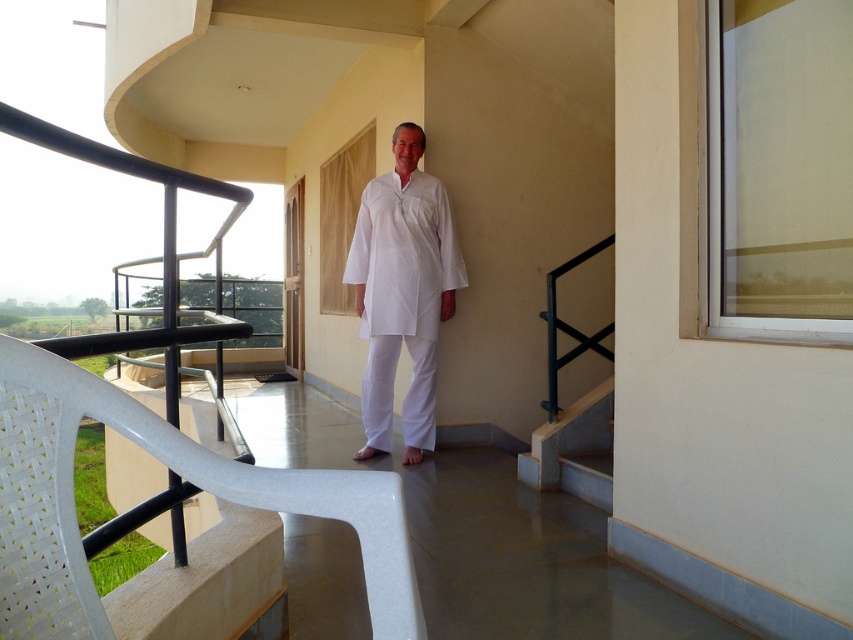
Question: Which of the following is the closest to the observer?

Choices:
 (A) (604, 403)
 (B) (421, 260)

Answer: (A)

Question: Can you confirm if white cotton kurta at center is bigger than concrete/stained at lower right?

Choices:
 (A) yes
 (B) no

Answer: (A)

Question: Does white cotton kurta at center have a lesser width compared to concrete/stained at lower right?

Choices:
 (A) yes
 (B) no

Answer: (B)

Question: In this image, where is white cotton kurta at center located relative to concrete/stained at lower right?

Choices:
 (A) below
 (B) above

Answer: (B)

Question: Which object is farther from the camera taking this photo?

Choices:
 (A) white cotton kurta at center
 (B) concrete/stained at lower right

Answer: (A)